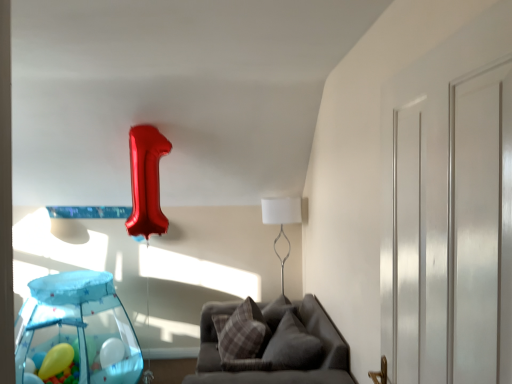
Question: Does white glossy door at right contain yellow rubber balloon at lower left?

Choices:
 (A) yes
 (B) no

Answer: (B)

Question: From a real-world perspective, is white glossy door at right positioned under yellow rubber balloon at lower left based on gravity?

Choices:
 (A) no
 (B) yes

Answer: (A)

Question: Considering the relative sizes of white glossy door at right and yellow rubber balloon at lower left in the image provided, is white glossy door at right thinner than yellow rubber balloon at lower left?

Choices:
 (A) no
 (B) yes

Answer: (B)

Question: From the image's perspective, is white glossy door at right located beneath yellow rubber balloon at lower left?

Choices:
 (A) no
 (B) yes

Answer: (A)

Question: Is white glossy door at right shorter than yellow rubber balloon at lower left?

Choices:
 (A) no
 (B) yes

Answer: (A)

Question: Considering the relative positions of white glossy door at right and yellow rubber balloon at lower left in the image provided, is white glossy door at right to the right of yellow rubber balloon at lower left from the viewer's perspective?

Choices:
 (A) yes
 (B) no

Answer: (A)

Question: Is plaid fabric pillow at center, which appears as the second pillow when viewed from the right, completely or partially outside of plush gray pillow at center, acting as the first pillow starting from the right?

Choices:
 (A) no
 (B) yes

Answer: (B)

Question: From a real-world perspective, is plaid fabric pillow at center, which appears as the second pillow when viewed from the right, physically above plush gray pillow at center, acting as the first pillow starting from the right?

Choices:
 (A) yes
 (B) no

Answer: (B)

Question: Can you confirm if plaid fabric pillow at center, the 1th pillow from the left, is shorter than plush gray pillow at center, acting as the 2th pillow starting from the left?

Choices:
 (A) yes
 (B) no

Answer: (B)

Question: Does plaid fabric pillow at center, the 1th pillow from the left, have a greater height compared to plush gray pillow at center, acting as the first pillow starting from the right?

Choices:
 (A) yes
 (B) no

Answer: (A)

Question: Is plaid fabric pillow at center, which appears as the second pillow when viewed from the right, thinner than plush gray pillow at center, acting as the 2th pillow starting from the left?

Choices:
 (A) no
 (B) yes

Answer: (B)

Question: Can you confirm if plaid fabric pillow at center, which appears as the second pillow when viewed from the right, is wider than plush gray pillow at center, acting as the first pillow starting from the right?

Choices:
 (A) yes
 (B) no

Answer: (B)

Question: Considering the relative positions of gray fabric couch at lower center and white glossy door at right in the image provided, is gray fabric couch at lower center in front of white glossy door at right?

Choices:
 (A) yes
 (B) no

Answer: (B)